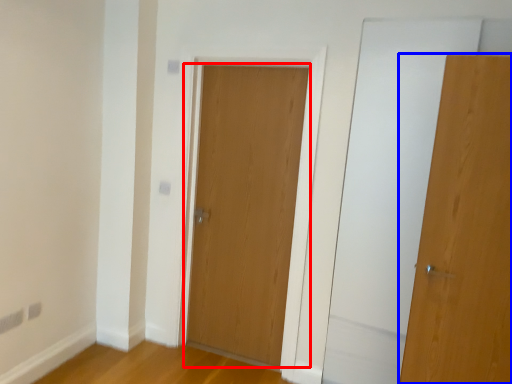
Question: Which point is closer to the camera, door (highlighted by a red box) or door (highlighted by a blue box)?

Choices:
 (A) door
 (B) door

Answer: (B)